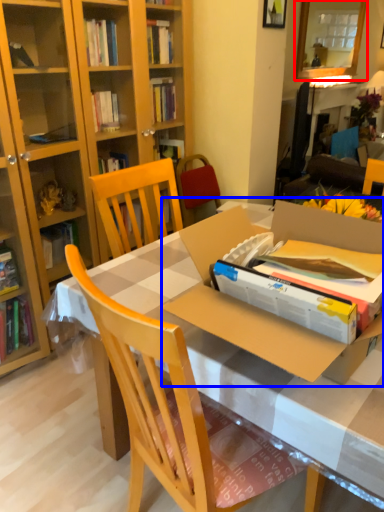
Question: Among these objects, which one is farthest to the camera, mirror (highlighted by a red box) or cardboard box (highlighted by a blue box)?

Choices:
 (A) mirror
 (B) cardboard box

Answer: (A)